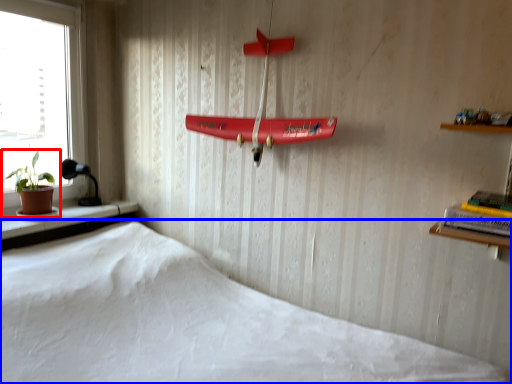
Question: Among these objects, which one is farthest to the camera, houseplant (highlighted by a red box) or bed (highlighted by a blue box)?

Choices:
 (A) houseplant
 (B) bed

Answer: (A)